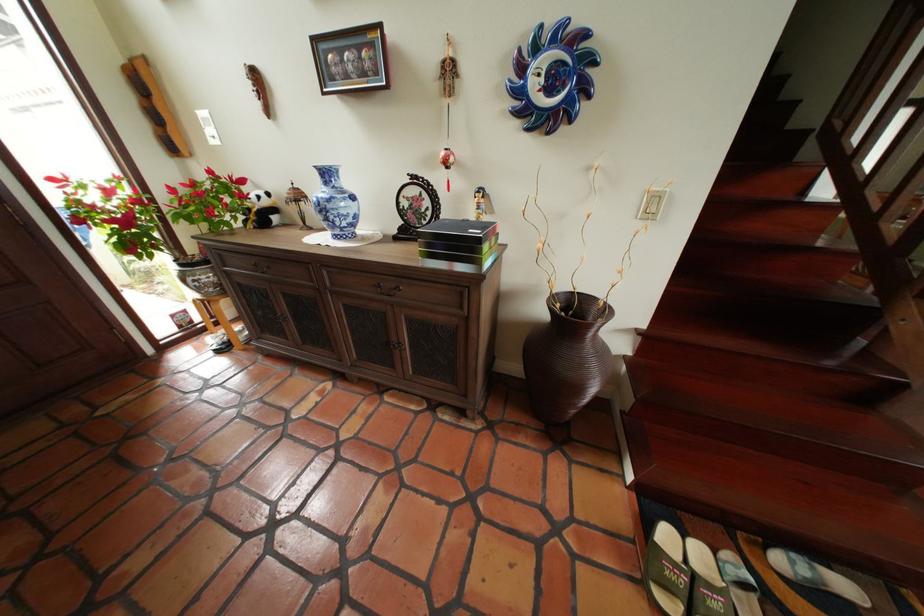
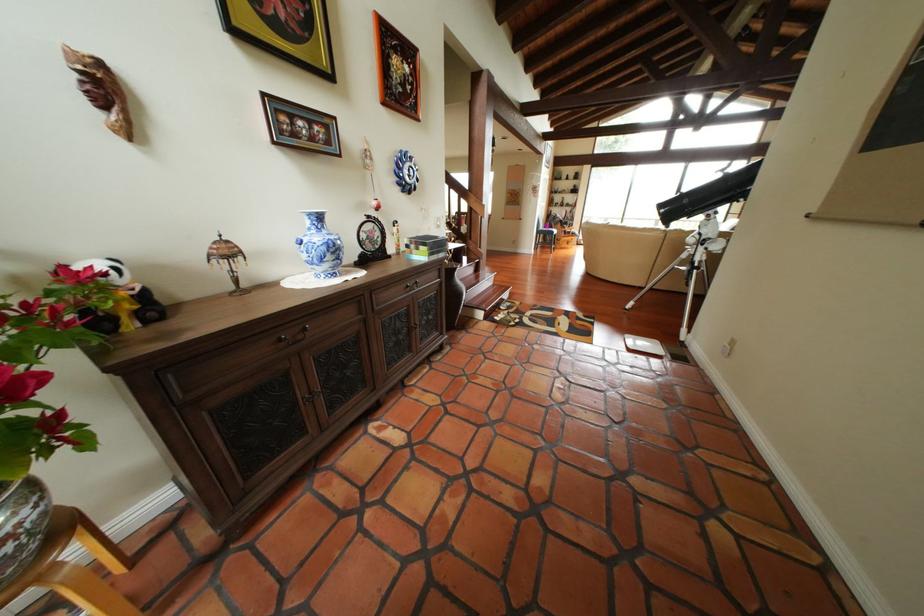
Where in the second image is the point corresponding to (x=333, y=217) from the first image?

(342, 257)